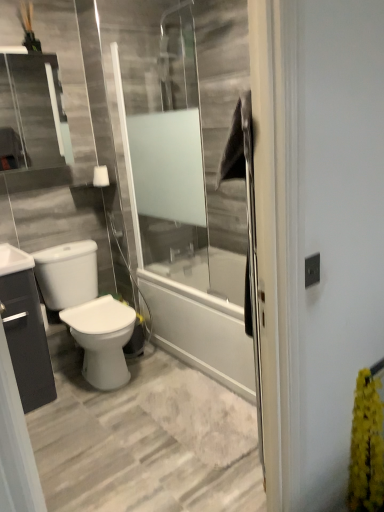
Find the location of a particular element. The width and height of the screenshot is (384, 512). spots to the right of white glossy toilet at lower left is located at coordinates (161, 373).